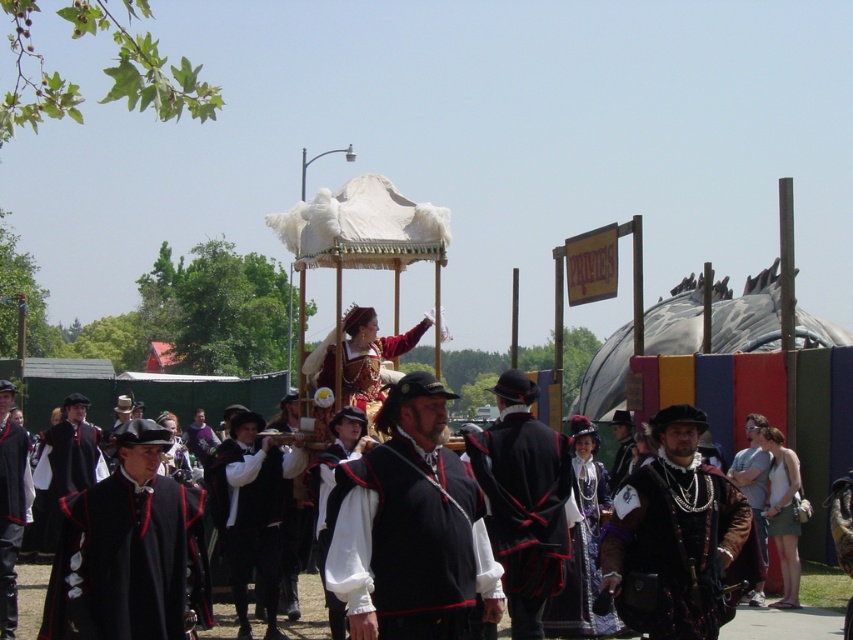
Question: Which point is farther from the camera taking this photo?

Choices:
 (A) (363, 397)
 (B) (508, 532)
 (C) (38, 483)
 (D) (10, 442)

Answer: (C)

Question: Is matte black vest at center thinner than matte black cape at left?

Choices:
 (A) no
 (B) yes

Answer: (A)

Question: Which object is closer to the camera taking this photo?

Choices:
 (A) white satin robe at center
 (B) black velvet cape at center

Answer: (B)

Question: Considering the real-world distances, which object is farthest from the matte black cape at left?

Choices:
 (A) velvet brown cape at center
 (B) white fluffy canopy at center

Answer: (B)

Question: Does black velvet cape at center appear under black velvet vest at center?

Choices:
 (A) yes
 (B) no

Answer: (A)

Question: Considering the relative positions of matte black vest at center and matte black coat at center in the image provided, where is matte black vest at center located with respect to matte black coat at center?

Choices:
 (A) above
 (B) below

Answer: (A)